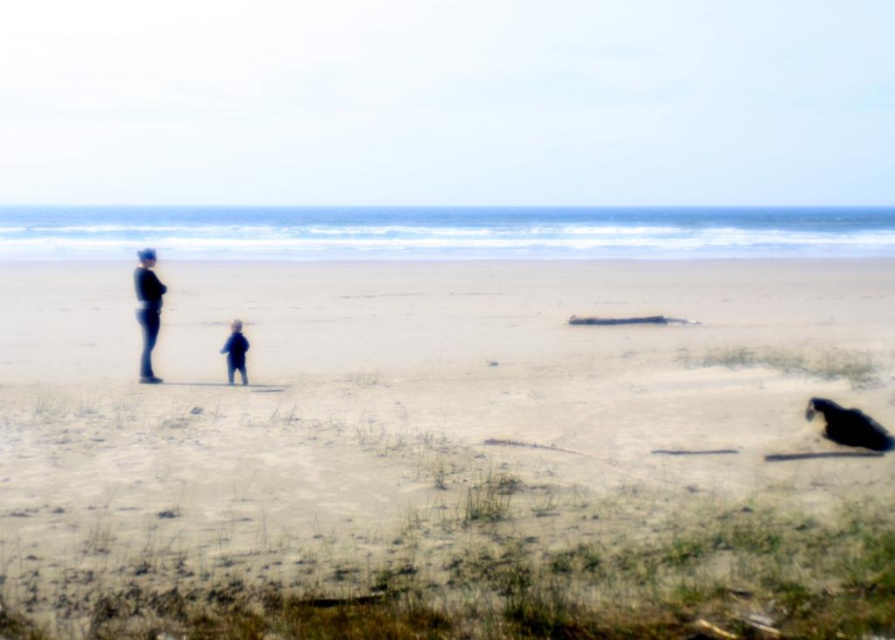
You are a photographer positioned at the camera location. You want to capture a photo where both the point at (891, 435) and the point at (142, 358) are visible. Which point will appear larger in the photo?

Point at (891, 435) will appear larger in the photo because it is closer to the camera than the point at (142, 358).